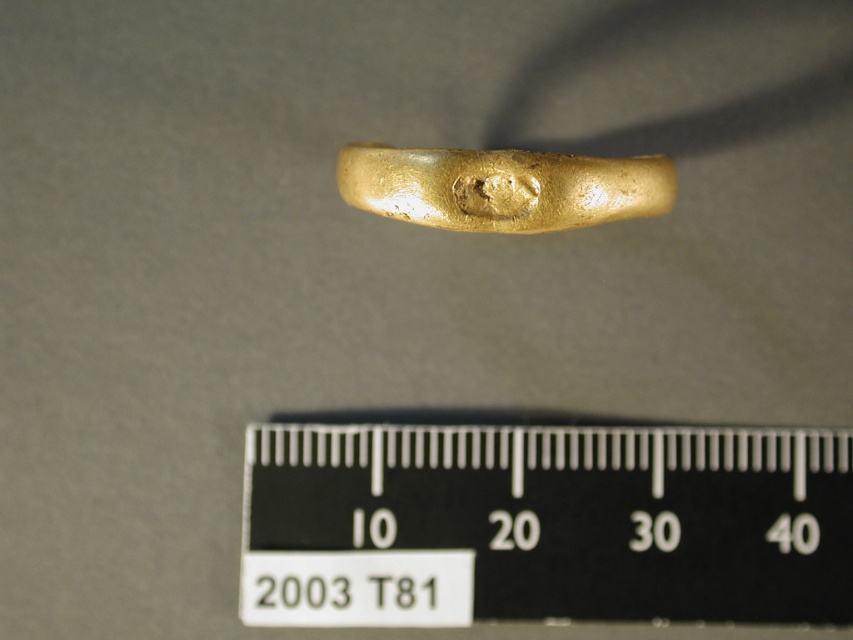
Between black plastic ruler at center and shiny gold ring at center, which one is positioned higher?

shiny gold ring at center

Is point (392, 502) more distant than point (389, 173)?

Yes, it is behind point (389, 173).

The image size is (853, 640). Describe the element at coordinates (544, 524) in the screenshot. I see `black plastic ruler at center` at that location.

In order to click on black plastic ruler at center in this screenshot , I will do `click(544, 524)`.